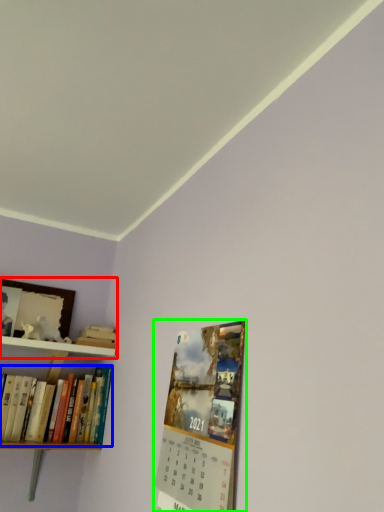
Question: Considering the real-world distances, which object is farthest from shelf (highlighted by a red box)? book (highlighted by a blue box) or magazine (highlighted by a green box)?

Choices:
 (A) book
 (B) magazine

Answer: (B)